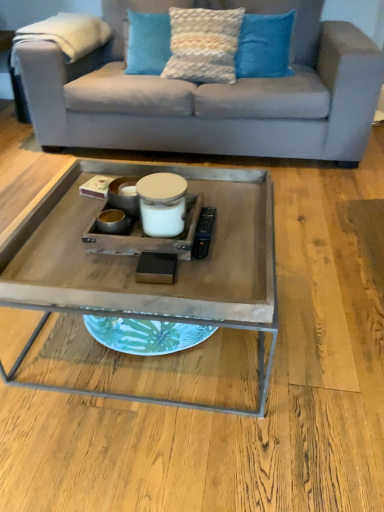
Identify the location of vacant area that lies to the right of wooden tray at center. (326, 301).